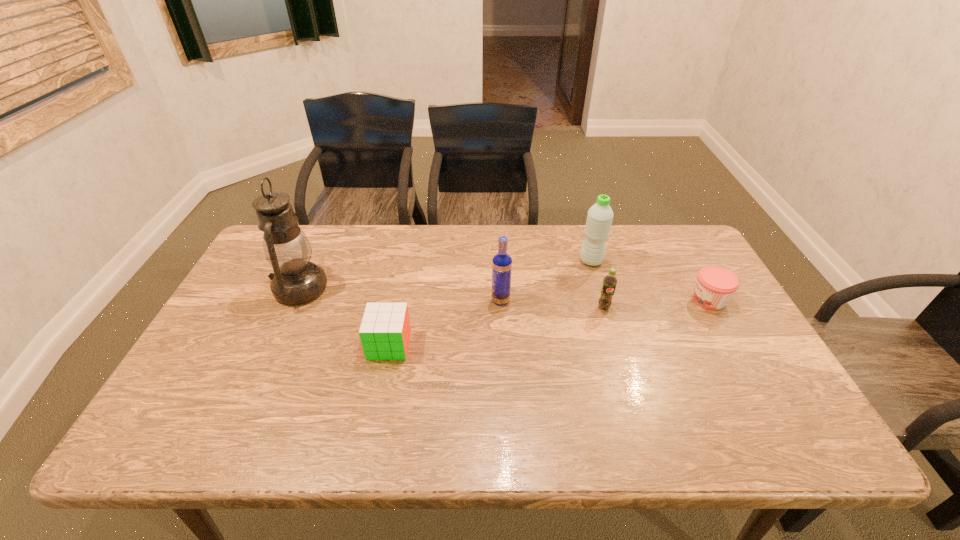
In order to click on free area in between the fifth object from right to left and the water bottle in this screenshot , I will do `click(490, 303)`.

Where is `empty location between the soda and the nearest object`? empty location between the soda and the nearest object is located at coordinates (496, 326).

At what (x,y) coordinates should I click in order to perform the action: click on vacant space that is in between the cube and the tallest object. Please return your answer as a coordinate pair (x, y). The width and height of the screenshot is (960, 540). Looking at the image, I should click on (345, 316).

The height and width of the screenshot is (540, 960). I want to click on vacant area that lies between the fourth tallest object and the tallest object, so click(x=452, y=298).

Locate an element on the screen. Image resolution: width=960 pixels, height=540 pixels. vacant area between the cube and the soda is located at coordinates (496, 326).

Locate an element on the screen. the fourth closest object relative to the fourth tallest object is located at coordinates (385, 330).

Identify the location of object that is the second nearest to the second object from left to right. This screenshot has height=540, width=960. (502, 262).

What are the coordinates of `free location that satisfies the following two spatial constraints: 1. on the front label of the rightmost object; 2. on the front label of the soda` in the screenshot? It's located at pos(713,307).